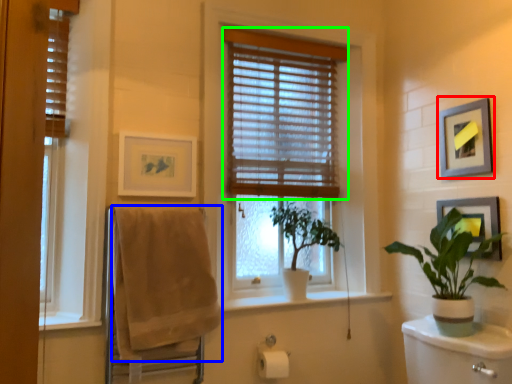
Question: Considering the real-world distances, which object is closest to picture frame (highlighted by a red box)? bath towel (highlighted by a blue box) or window blind (highlighted by a green box).

Choices:
 (A) bath towel
 (B) window blind

Answer: (B)